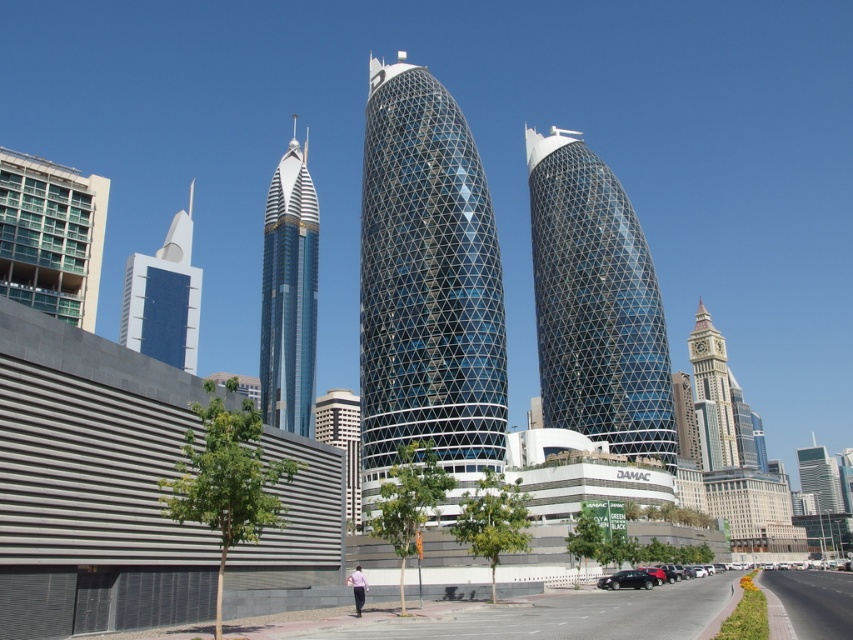
Can you confirm if glassy metallic skyscraper at right is positioned below shiny black sedan at lower center?

Correct, glassy metallic skyscraper at right is located below shiny black sedan at lower center.

Does glassy metallic skyscraper at right appear on the left side of shiny black sedan at lower center?

In fact, glassy metallic skyscraper at right is to the right of shiny black sedan at lower center.

Which is in front, point (805, 477) or point (630, 576)?

Positioned in front is point (630, 576).

Identify the location of glassy metallic skyscraper at right. This screenshot has width=853, height=640. (817, 477).

Can you confirm if green glass building at upper left is positioned below shiny black sedan at lower center?

Incorrect, green glass building at upper left is not positioned below shiny black sedan at lower center.

Can you confirm if green glass building at upper left is wider than shiny black sedan at lower center?

Indeed, green glass building at upper left has a greater width compared to shiny black sedan at lower center.

You are a GUI agent. You are given a task and a screenshot of the screen. Output one action in this format:
    pyautogui.click(x=<x>, y=<y>)
    Task: Click on the green glass building at upper left
    
    Given the screenshot: What is the action you would take?
    50,236

I want to click on green glass building at upper left, so click(x=50, y=236).

Who is shorter, transparent glass tower at center or shiny black sedan at lower center?

shiny black sedan at lower center is shorter.

Does transparent glass tower at center come behind shiny black sedan at lower center?

That is True.

Between point (448, 400) and point (624, 579), which one is positioned behind?

Positioned behind is point (448, 400).

The width and height of the screenshot is (853, 640). In order to click on transparent glass tower at center in this screenshot , I will do 426,285.